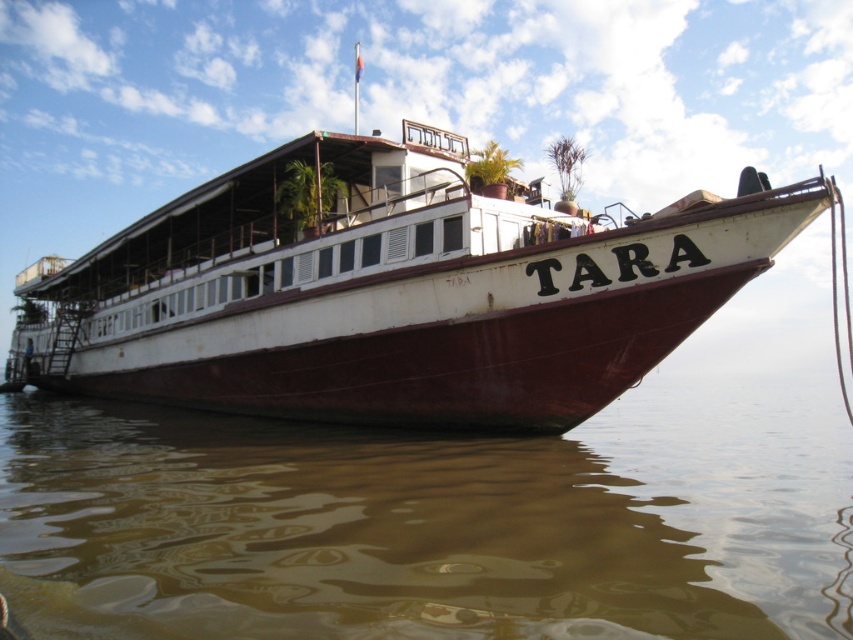
Is brown matte water at lower center below rustic wood boat at center?

Indeed, brown matte water at lower center is positioned under rustic wood boat at center.

Looking at this image, which of these two, brown matte water at lower center or rustic wood boat at center, stands shorter?

With less height is brown matte water at lower center.

The image size is (853, 640). Find the location of `brown matte water at lower center`. brown matte water at lower center is located at coordinates (438, 520).